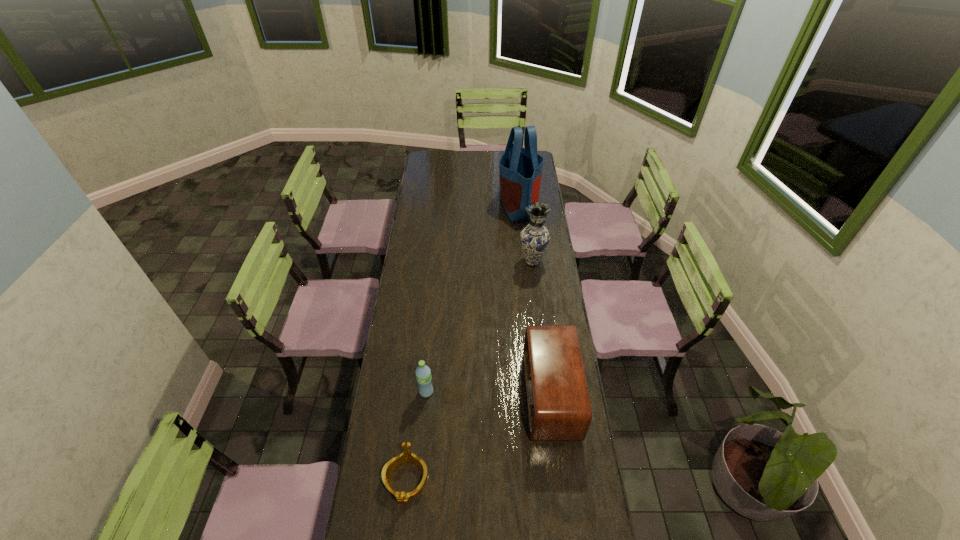
Where is `the farthest object`? This screenshot has width=960, height=540. the farthest object is located at coordinates (520, 168).

The height and width of the screenshot is (540, 960). I want to click on the tallest object, so click(520, 168).

This screenshot has height=540, width=960. Find the location of `the fourth nearest object`. the fourth nearest object is located at coordinates (535, 238).

The image size is (960, 540). I want to click on the fourth shortest object, so click(535, 238).

Where is `radio receiver`? The width and height of the screenshot is (960, 540). radio receiver is located at coordinates (559, 409).

Locate an element on the screen. This screenshot has width=960, height=540. water bottle is located at coordinates (423, 373).

Identify the location of tiara. This screenshot has width=960, height=540. (407, 456).

Where is `the shortest object`? This screenshot has width=960, height=540. the shortest object is located at coordinates (407, 456).

The image size is (960, 540). I want to click on vacant space located on the left of the tallest object, so click(425, 205).

At what (x,y) coordinates should I click in order to perform the action: click on free space located 0.080m on the left of the fourth shortest object. Please return your answer as a coordinate pair (x, y). The width and height of the screenshot is (960, 540). Looking at the image, I should click on (501, 261).